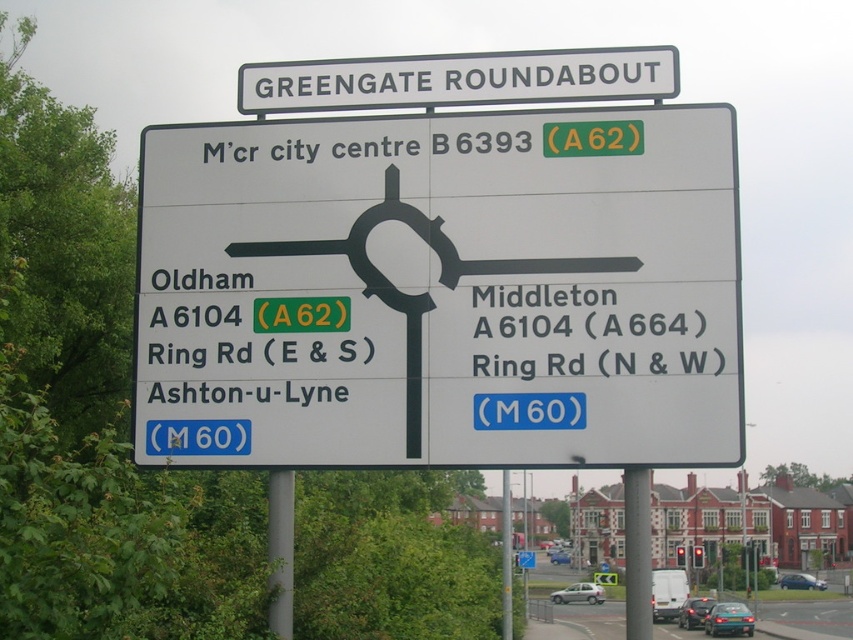
Question: Is white plastic signboard at upper center in front of metallic gray pole at center?

Choices:
 (A) yes
 (B) no

Answer: (B)

Question: Which point appears farthest from the camera in this image?

Choices:
 (A) (556, 552)
 (B) (653, 360)

Answer: (A)

Question: Does white plastic sign at center have a larger size compared to metallic gray pole at center?

Choices:
 (A) no
 (B) yes

Answer: (A)

Question: Is the position of metallic pole at center less distant than that of blue metallic car at center?

Choices:
 (A) yes
 (B) no

Answer: (A)

Question: Which object is farther from the camera taking this photo?

Choices:
 (A) gray metallic pole at lower center
 (B) metallic gray pole at center
 (C) metallic blue car at center

Answer: (C)

Question: Among these points, which one is nearest to the camera?

Choices:
 (A) (287, 483)
 (B) (254, 372)
 (C) (718, 632)
 (D) (579, 600)

Answer: (B)